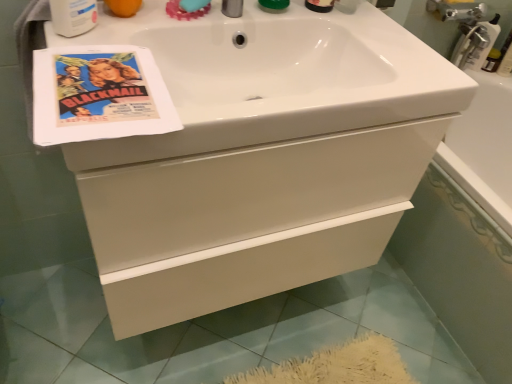
Image resolution: width=512 pixels, height=384 pixels. I want to click on free space between white plastic mouthwash at upper left and teal rubber soap at upper center, so click(x=132, y=24).